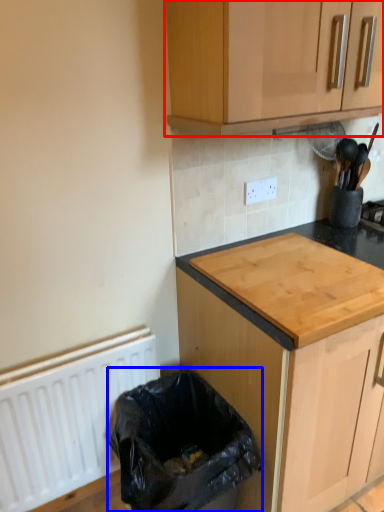
Question: Which object appears closest to the camera in this image, cabinetry (highlighted by a red box) or recycling bin (highlighted by a blue box)?

Choices:
 (A) cabinetry
 (B) recycling bin

Answer: (A)